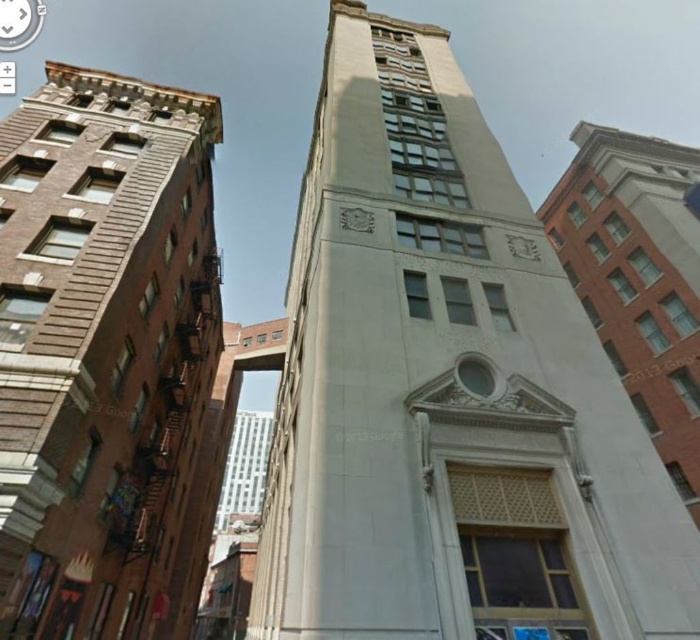
You are standing on the sidewalk in front of the white stone tower at center and the brown brick building at left. Which building is closer to you?

The white stone tower at center is closer to the viewer than the brown brick building at left, so the white stone tower at center is closer to you.

You are a city planner assessing the urban space between the white stone tower at center and the white plastic clock at upper left. Given their sizes, which object would cast a longer shadow during midday when the sun is directly overhead?

The white stone tower at center has a larger size compared to the white plastic clock at upper left, so it would cast a longer shadow during midday when the sun is directly overhead.

You are a pedestrian standing on the sidewalk in front of the tall, narrow building. You notice the brown brick building at left and the white plastic clock at upper left. Which of these two objects is positioned higher up in your field of view?

The white plastic clock at upper left is positioned higher up in the field of view since the brown brick building at left is located below it.